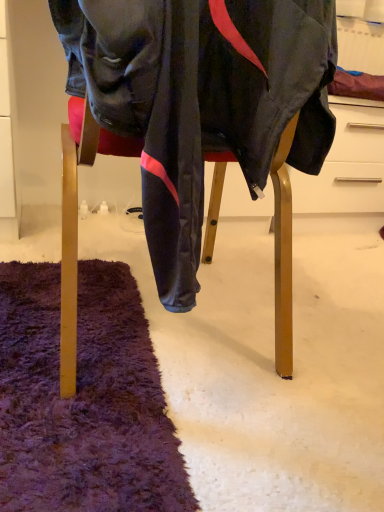
Where is `velvet black pants at lower center`? The image size is (384, 512). velvet black pants at lower center is located at coordinates (201, 100).

What do you see at coordinates (201, 100) in the screenshot? The image size is (384, 512). I see `velvet black pants at lower center` at bounding box center [201, 100].

Identify the location of velvet black pants at lower center. Image resolution: width=384 pixels, height=512 pixels. (201, 100).